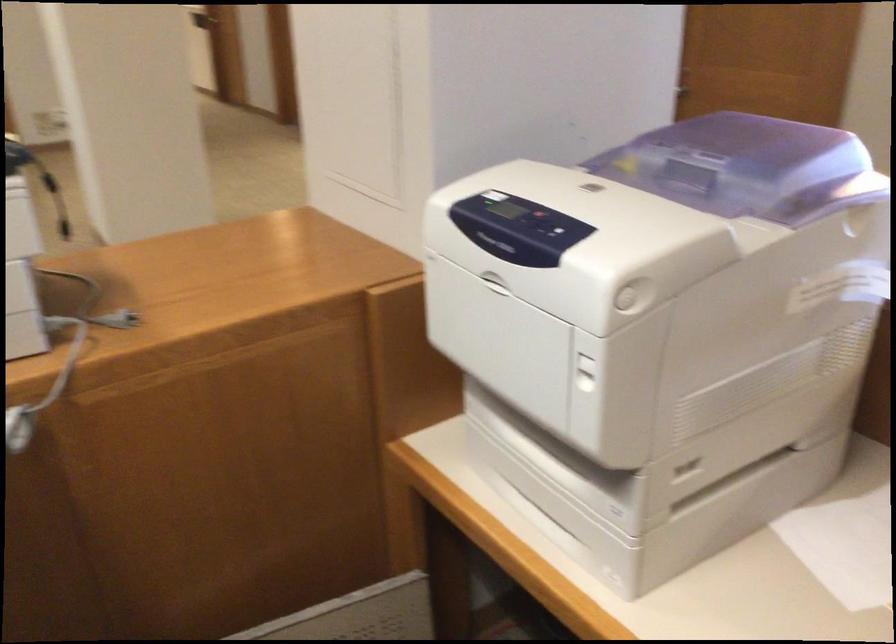
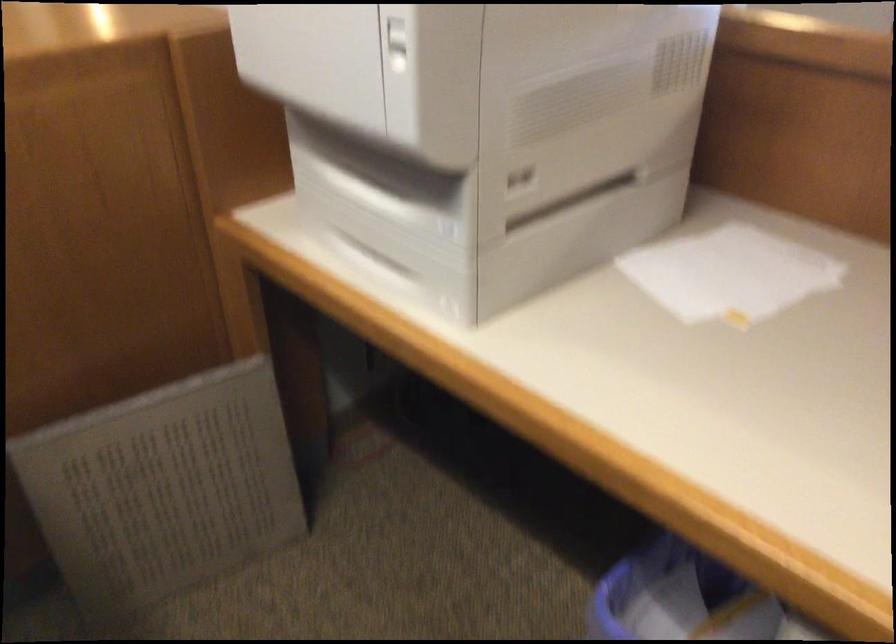
Locate, in the second image, the point that corresponds to (x=561, y=488) in the first image.

(391, 220)